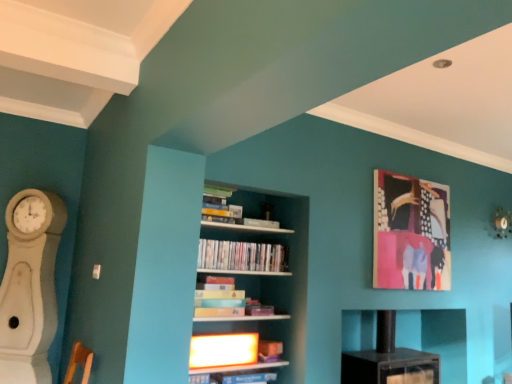
Question: In which direction should I rotate to look at matte black shelf at center, marked as the 2th shelf in a front-to-back arrangement?

Choices:
 (A) right
 (B) left

Answer: (A)

Question: Should I look upward or downward to see matte cardboard book at center, arranged as the third book when viewed from the top?

Choices:
 (A) down
 (B) up

Answer: (A)

Question: Is white wood fireplace at left oriented away from matte green book at upper center, marked as the 1th book in a top-to-bottom arrangement?

Choices:
 (A) yes
 (B) no

Answer: (B)

Question: Does white wood fireplace at left have a lesser width compared to matte green book at upper center, positioned as the 4th book in bottom-to-top order?

Choices:
 (A) yes
 (B) no

Answer: (B)

Question: From the image's perspective, would you say white wood fireplace at left is shown under matte green book at upper center, positioned as the 4th book in bottom-to-top order?

Choices:
 (A) no
 (B) yes

Answer: (B)

Question: From the image's perspective, is white wood fireplace at left on matte green book at upper center, positioned as the 4th book in bottom-to-top order?

Choices:
 (A) yes
 (B) no

Answer: (B)

Question: Is white wood fireplace at left aimed at matte green book at upper center, marked as the 1th book in a top-to-bottom arrangement?

Choices:
 (A) no
 (B) yes

Answer: (A)

Question: Does white wood fireplace at left have a greater width compared to matte green book at upper center, positioned as the 4th book in bottom-to-top order?

Choices:
 (A) yes
 (B) no

Answer: (A)

Question: Does abstract painting at upper right have a greater height compared to matte white shelf at center, which is the first shelf from left to right?

Choices:
 (A) no
 (B) yes

Answer: (B)

Question: Is abstract painting at upper right thinner than matte white shelf at center, which is the second shelf in right-to-left order?

Choices:
 (A) yes
 (B) no

Answer: (A)

Question: Would you say abstract painting at upper right contains matte white shelf at center, which is the second shelf in right-to-left order?

Choices:
 (A) yes
 (B) no

Answer: (B)

Question: Does abstract painting at upper right touch matte white shelf at center, which is the first shelf from left to right?

Choices:
 (A) yes
 (B) no

Answer: (B)

Question: Considering the relative sizes of abstract painting at upper right and matte white shelf at center, marked as the 1th shelf in a front-to-back arrangement, in the image provided, is abstract painting at upper right wider than matte white shelf at center, marked as the 1th shelf in a front-to-back arrangement,?

Choices:
 (A) no
 (B) yes

Answer: (A)

Question: From the image's perspective, is abstract painting at upper right below matte white shelf at center, marked as the 1th shelf in a front-to-back arrangement?

Choices:
 (A) no
 (B) yes

Answer: (A)

Question: Does abstract painting at upper right have a greater width compared to matte cardboard book at center, the 2th book from the bottom?

Choices:
 (A) yes
 (B) no

Answer: (B)